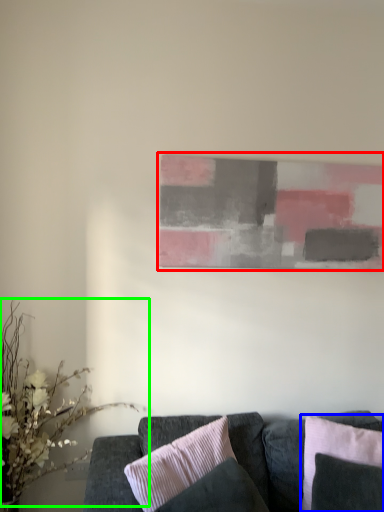
Question: Estimate the real-world distances between objects in this image. Which object is closer to picture frame (highlighted by a red box), pillow (highlighted by a blue box) or floral arrangement (highlighted by a green box)?

Choices:
 (A) pillow
 (B) floral arrangement

Answer: (A)